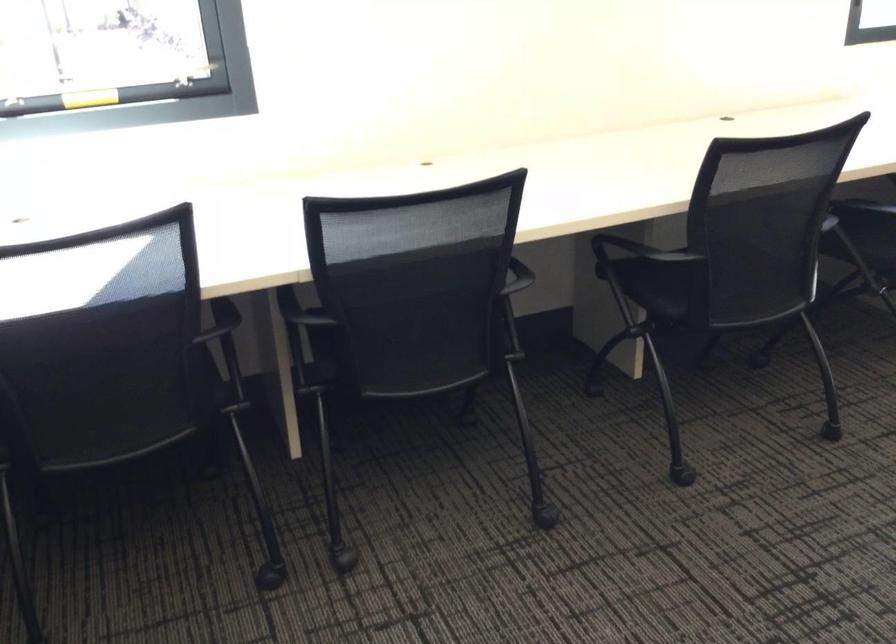
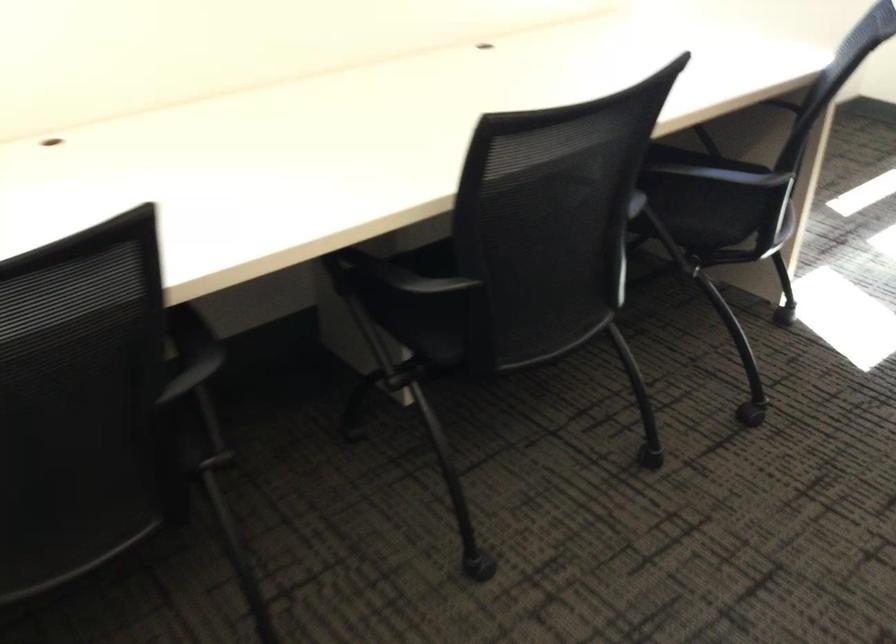
Question: The images are taken continuously from a first-person perspective. In which direction are you moving?

Choices:
 (A) Left
 (B) Right
 (C) Forward
 (D) Backward

Answer: (C)